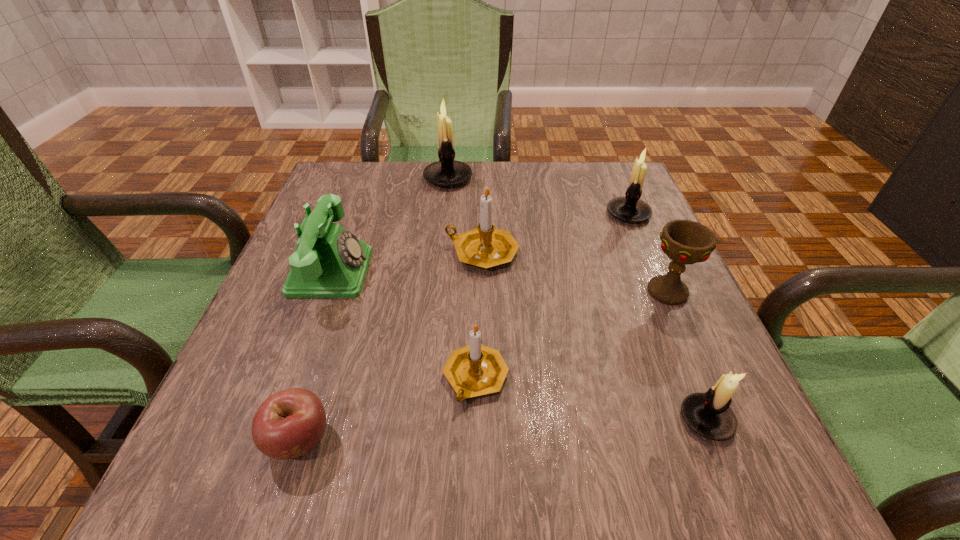
Locate an element on the screen. telephone that is at the left edge is located at coordinates (329, 262).

Where is `apple located at the left edge`? This screenshot has width=960, height=540. apple located at the left edge is located at coordinates (288, 424).

Find the location of a particular element. chalice present at the right edge is located at coordinates (684, 241).

Identify the location of object present at the near left corner. (288, 424).

Locate an element on the screen. This screenshot has width=960, height=540. object situated at the far right corner is located at coordinates (630, 208).

You are a GUI agent. You are given a task and a screenshot of the screen. Output one action in this format:
    pyautogui.click(x=<x>, y=<y>)
    Task: Click on the object that is positioned at the near right corner
    This screenshot has width=960, height=540.
    Given the screenshot: What is the action you would take?
    pyautogui.click(x=708, y=414)

At what (x,y) coordinates should I click in order to perform the action: click on vacant area at the far edge of the desktop. Please return your answer as a coordinate pair (x, y). Image resolution: width=960 pixels, height=540 pixels. Looking at the image, I should click on (556, 187).

Where is `vacant space at the left edge of the desktop`? vacant space at the left edge of the desktop is located at coordinates (211, 436).

This screenshot has height=540, width=960. Find the location of `free space at the right edge`. free space at the right edge is located at coordinates (642, 392).

Where is `blank space at the far left corner`? The image size is (960, 540). blank space at the far left corner is located at coordinates (380, 176).